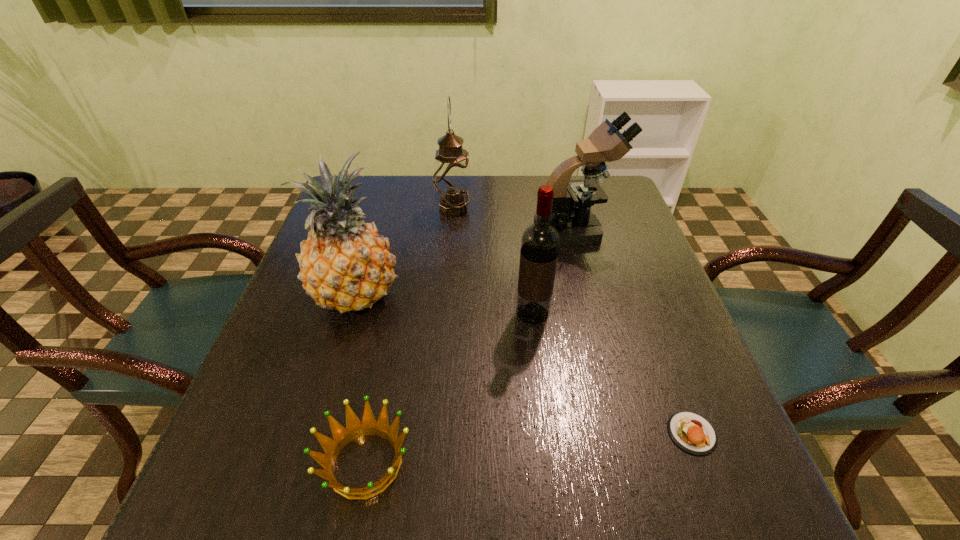
This screenshot has width=960, height=540. Identify the location of free space located 0.140m on the back of the crown. (386, 356).

Locate an element on the screen. The height and width of the screenshot is (540, 960). free spot located on the left of the patty (food) is located at coordinates (639, 433).

Where is `oil lamp at the far edge`? oil lamp at the far edge is located at coordinates (451, 178).

Locate an element on the screen. This screenshot has height=540, width=960. microscope at the far edge is located at coordinates (577, 225).

Identify the location of object positioned at the near edge. The image size is (960, 540). (355, 428).

Image resolution: width=960 pixels, height=540 pixels. I want to click on object that is at the left edge, so click(x=345, y=264).

You are a GUI agent. You are given a task and a screenshot of the screen. Output one action in this format:
    pyautogui.click(x=<x>, y=<y>)
    Task: Click on the microscope located in the right edge section of the desktop
    
    Given the screenshot: What is the action you would take?
    pyautogui.click(x=577, y=225)

You are a GUI agent. You are given a task and a screenshot of the screen. Output one action in this format:
    pyautogui.click(x=<x>, y=<y>)
    Task: Click on the patty (food) situated at the right edge
    
    Given the screenshot: What is the action you would take?
    pyautogui.click(x=691, y=432)

The image size is (960, 540). In order to click on object present at the far right corner in this screenshot , I will do `click(577, 225)`.

The image size is (960, 540). What are the coordinates of `free space at the far edge` in the screenshot? It's located at (515, 187).